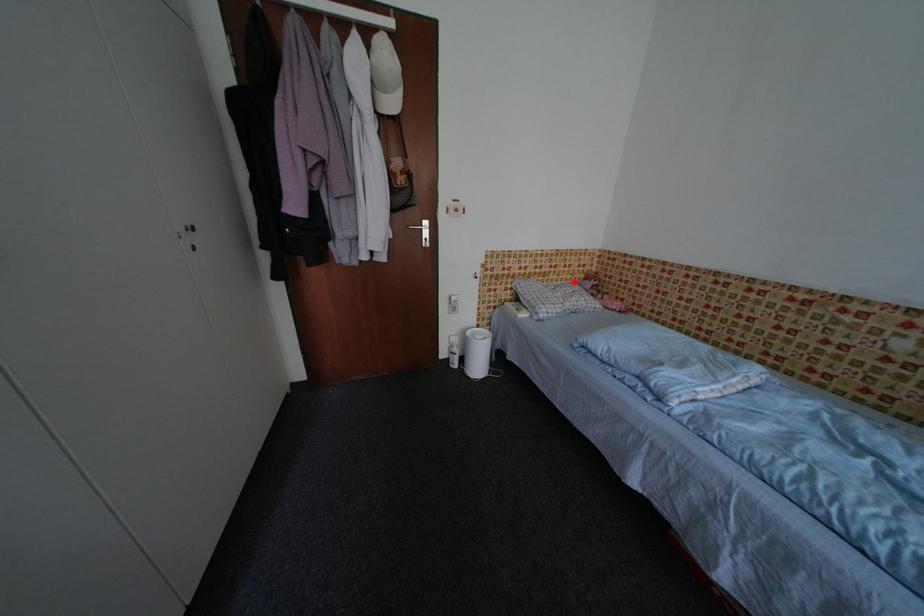
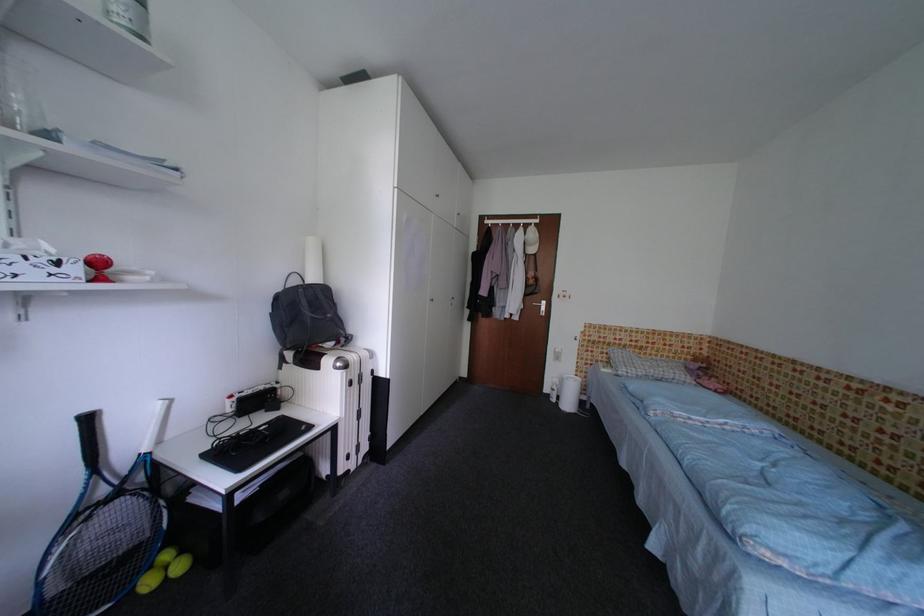
Question: I am providing you with two images of the same scene from different viewpoints. A red point is shown in image1. For the corresponding object point in image2, is it positioned nearer or farther from the camera?

Choices:
 (A) Nearer
 (B) Farther

Answer: (B)